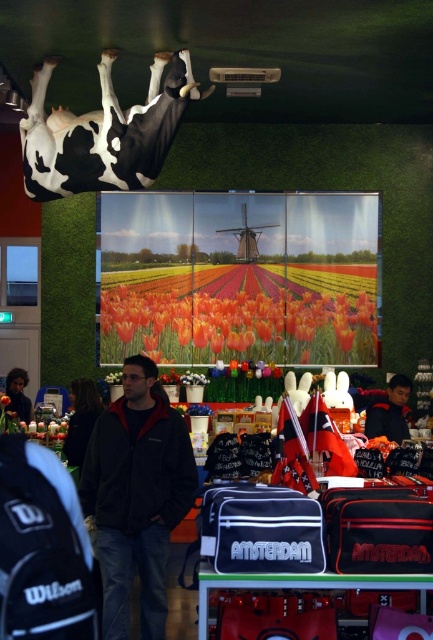
Question: Among these objects, which one is nearest to the camera?

Choices:
 (A) dark gray fleece jacket at center
 (B) black and white cow at upper center
 (C) dark blue jacket at center
 (D) dark brown hair at lower left

Answer: (A)

Question: Can you confirm if black and white cow at upper center is positioned to the left of dark brown hair at lower left?

Choices:
 (A) no
 (B) yes

Answer: (A)

Question: Among these points, which one is nearest to the camera?

Choices:
 (A) (106, 621)
 (B) (22, 378)
 (C) (131, 147)

Answer: (A)

Question: Can you confirm if dark gray fleece jacket at center is positioned below dark brown hair at lower left?

Choices:
 (A) no
 (B) yes

Answer: (B)

Question: Which of the following is the farthest from the observer?

Choices:
 (A) (149, 504)
 (B) (168, 93)
 (C) (398, 392)

Answer: (C)

Question: Is dark gray fleece jacket at center above dark brown hair at lower left?

Choices:
 (A) yes
 (B) no

Answer: (B)